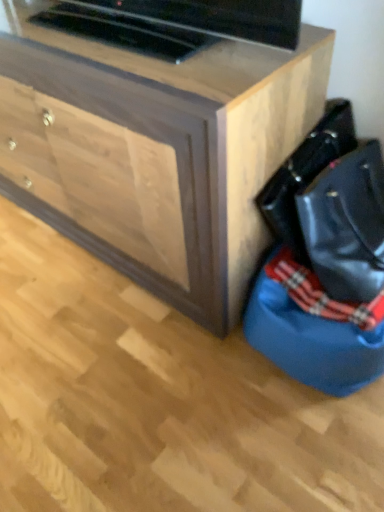
Question: From the image's perspective, is wooden chest of drawers at center located above or below black leather messenger bag at lower right?

Choices:
 (A) above
 (B) below

Answer: (A)

Question: Is point (46, 56) closer or farther from the camera than point (289, 224)?

Choices:
 (A) farther
 (B) closer

Answer: (B)

Question: Which object is positioned farthest from the black leather messenger bag at lower right?

Choices:
 (A) wooden chest of drawers at center
 (B) blue satin blanket at lower right
 (C) blue fabric bean bag at lower right

Answer: (A)

Question: Estimate the real-world distances between objects in this image. Which object is farther from the wooden chest of drawers at center?

Choices:
 (A) black leather messenger bag at lower right
 (B) blue fabric bean bag at lower right
 (C) blue satin blanket at lower right

Answer: (C)